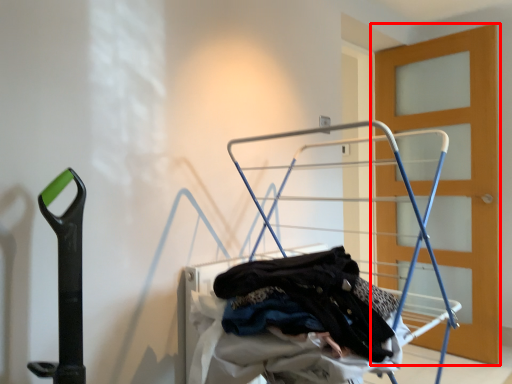
Question: From the image, what is the correct spatial relationship of door (annotated by the red box) in relation to baby carriage?

Choices:
 (A) left
 (B) right

Answer: (B)